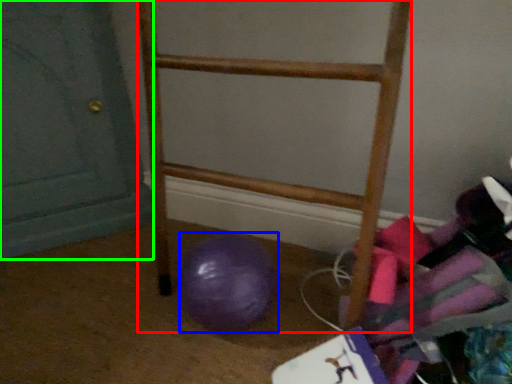
Question: Based on their relative distances, which object is nearer to furniture (highlighted by a red box)? Choose from ball (highlighted by a blue box) and door (highlighted by a green box).

Choices:
 (A) ball
 (B) door

Answer: (A)